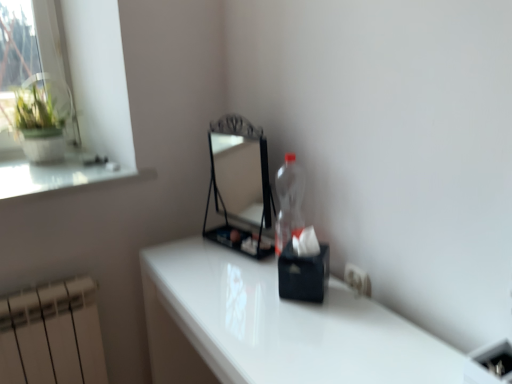
Find the location of a particular element. This screenshot has height=384, width=512. metallic black mirror at center is located at coordinates (240, 185).

Locate an element on the screen. metallic black mirror at center is located at coordinates (240, 185).

The height and width of the screenshot is (384, 512). I want to click on table in front of the metallic black mirror at center, so click(274, 327).

Is white glossy table at center facing away from metallic black mirror at center?

That's not correct — white glossy table at center is not looking away from metallic black mirror at center.

Consider the image. Between white glossy table at center and metallic black mirror at center, which one is positioned behind?

metallic black mirror at center is more distant.

Is white plastic electric outlet at lower right far away from white glossy table at center?

No, white plastic electric outlet at lower right is not far away from white glossy table at center.

Which is farther, (362, 284) or (226, 299)?

The point (226, 299) is more distant.

Considering the positions of objects white plastic electric outlet at lower right and white glossy table at center in the image provided, who is in front, white plastic electric outlet at lower right or white glossy table at center?

white glossy table at center is in front.

Which is correct: white plastic electric outlet at lower right is inside white glossy table at center, or outside of it?

white plastic electric outlet at lower right is located beyond the bounds of white glossy table at center.

From the image's perspective, is white plastic electric outlet at lower right located above metallic black mirror at center?

No, from the image's perspective, white plastic electric outlet at lower right is not on top of metallic black mirror at center.

Based on the photo, considering the relative sizes of white plastic electric outlet at lower right and metallic black mirror at center in the image provided, is white plastic electric outlet at lower right bigger than metallic black mirror at center?

Actually, white plastic electric outlet at lower right might be smaller than metallic black mirror at center.

Is white plastic electric outlet at lower right not inside metallic black mirror at center?

Yes, white plastic electric outlet at lower right is not within metallic black mirror at center.

The image size is (512, 384). I want to click on table beneath the metallic black mirror at center (from a real-world perspective), so click(x=274, y=327).

From a real-world perspective, is metallic black mirror at center over white glossy table at center?

Correct, in the physical world, metallic black mirror at center is higher than white glossy table at center.

Is white glossy table at center surrounded by metallic black mirror at center?

No.

In terms of width, does metallic black mirror at center look wider or thinner when compared to white glossy table at center?

metallic black mirror at center is thinner than white glossy table at center.

Which object is closer to the camera, metallic black mirror at center or white plastic electric outlet at lower right?

Positioned in front is white plastic electric outlet at lower right.

Consider the image. Which is correct: metallic black mirror at center is inside white plastic electric outlet at lower right, or outside of it?

The correct answer is: outside.

Can you confirm if metallic black mirror at center is thinner than white plastic electric outlet at lower right?

No.

At what (x,y) coordinates should I click in order to perform the action: click on electric outlet below the metallic black mirror at center (from the image's perspective). Please return your answer as a coordinate pair (x, y). This screenshot has width=512, height=384. Looking at the image, I should click on (357, 279).

Is white glossy table at center situated inside white plastic electric outlet at lower right or outside?

white glossy table at center is not enclosed by white plastic electric outlet at lower right.

Which object is closer to the camera taking this photo, white glossy table at center or white plastic electric outlet at lower right?

white glossy table at center is closer to the camera.

Which object is positioned more to the right, white glossy table at center or white plastic electric outlet at lower right?

Positioned to the right is white plastic electric outlet at lower right.

In order to click on table that is below the metallic black mirror at center (from the image's perspective) in this screenshot , I will do `click(274, 327)`.

This screenshot has width=512, height=384. What are the coordinates of `electric outlet lying behind the white glossy table at center` in the screenshot? It's located at (357, 279).

Based on their spatial positions, is metallic black mirror at center or white plastic electric outlet at lower right further from white glossy table at center?

metallic black mirror at center lies further to white glossy table at center than the other object.

Estimate the real-world distances between objects in this image. Which object is closer to white plastic electric outlet at lower right, metallic black mirror at center or white glossy table at center?

white glossy table at center lies closer to white plastic electric outlet at lower right than the other object.

Considering their positions, is white glossy table at center positioned closer to metallic black mirror at center than white plastic electric outlet at lower right?

Based on the image, white glossy table at center appears to be nearer to metallic black mirror at center.

From the image, which object appears to be farther from white plastic electric outlet at lower right, white glossy table at center or metallic black mirror at center?

Based on the image, metallic black mirror at center appears to be further to white plastic electric outlet at lower right.

Looking at the image, which one is located closer to white glossy table at center, white plastic electric outlet at lower right or metallic black mirror at center?

Among the two, white plastic electric outlet at lower right is located nearer to white glossy table at center.

From the image, which object appears to be farther from metallic black mirror at center, white plastic electric outlet at lower right or white glossy table at center?

white plastic electric outlet at lower right is positioned further to the anchor metallic black mirror at center.

Where is `electric outlet between metallic black mirror at center and white glossy table at center vertically`? The height and width of the screenshot is (384, 512). electric outlet between metallic black mirror at center and white glossy table at center vertically is located at coordinates (357, 279).